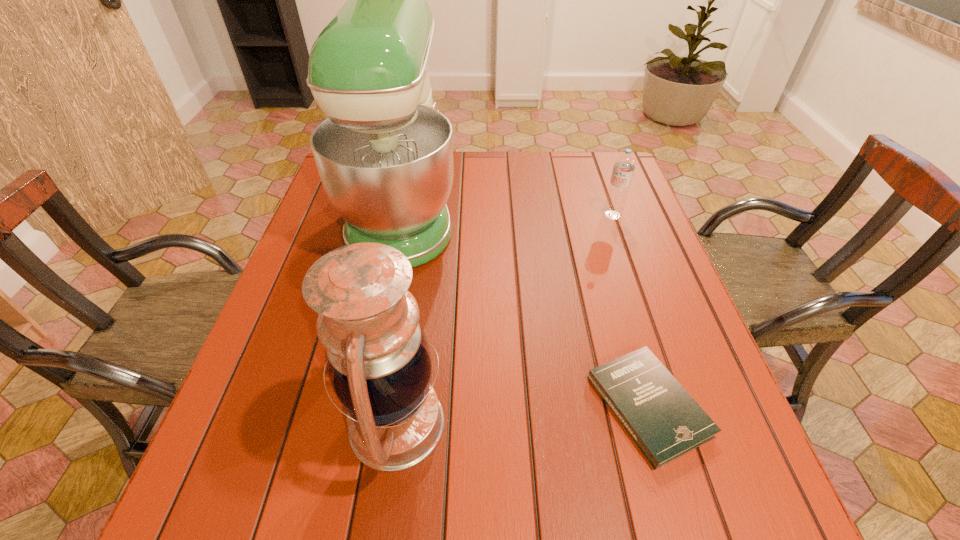
You are a GUI agent. You are given a task and a screenshot of the screen. Output one action in this format:
    pyautogui.click(x=<x>, y=<y>)
    Task: Click on the free spot that satisfies the following two spatial constraints: 1. on the back side of the oil lamp; 2. on the right side of the third tallest object
    
    Given the screenshot: What is the action you would take?
    pyautogui.click(x=426, y=215)

This screenshot has width=960, height=540. What are the coordinates of `free location that satisfies the following two spatial constraints: 1. on the controls of the oil lamp; 2. on the left side of the mixer` in the screenshot? It's located at [x=360, y=423].

Identify the location of blank space that satisfies the following two spatial constraints: 1. on the back side of the oil lamp; 2. on the left side of the third tallest object. The height and width of the screenshot is (540, 960). (426, 215).

Locate an element on the screen. The height and width of the screenshot is (540, 960). vacant space that satisfies the following two spatial constraints: 1. on the controls of the tallest object; 2. on the back side of the oil lamp is located at coordinates (360, 423).

Identify the location of free spot that satisfies the following two spatial constraints: 1. on the controls of the shortest object; 2. on the left side of the tallest object. The width and height of the screenshot is (960, 540). (364, 406).

In order to click on blank space that satisfies the following two spatial constraints: 1. on the back side of the water bottle; 2. on the controls of the tallest object in this screenshot , I will do `click(611, 211)`.

Locate an element on the screen. This screenshot has width=960, height=540. vacant region that satisfies the following two spatial constraints: 1. on the controls of the third tallest object; 2. on the right side of the mixer is located at coordinates pyautogui.click(x=403, y=215).

The image size is (960, 540). I want to click on vacant area that satisfies the following two spatial constraints: 1. on the controls of the oil lamp; 2. on the right side of the mixer, so click(360, 423).

Identify the location of vacant space that satisfies the following two spatial constraints: 1. on the controls of the book; 2. on the left side of the tallest object. (364, 406).